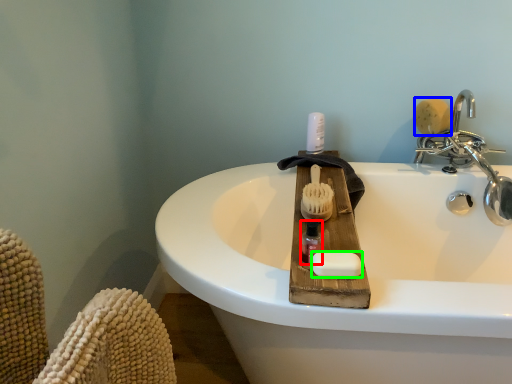
Question: Which object is positioned closest to mouthwash (highlighted by a red box)? Select from brush (highlighted by a blue box) and soap (highlighted by a green box).

Choices:
 (A) brush
 (B) soap

Answer: (B)